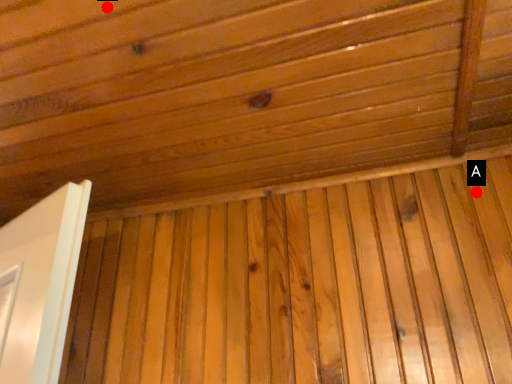
Question: Two points are circled on the image, labeled by A and B beside each circle. Which point is farther from the camera taking this photo?

Choices:
 (A) A is further
 (B) B is further

Answer: (A)